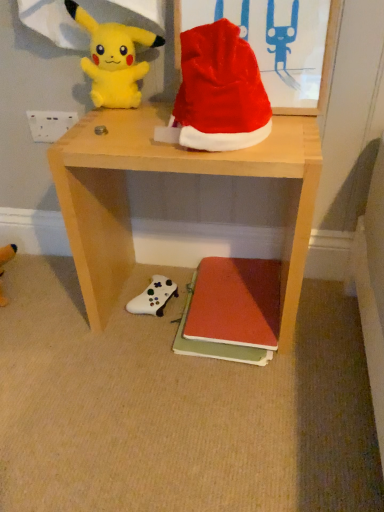
Question: Should I look upward or downward to see white matte game controller at lower center, acting as the first toy starting from the back?

Choices:
 (A) up
 (B) down

Answer: (B)

Question: Is wooden desk at center aimed at white matte game controller at lower center, positioned as the 2th toy in top-to-bottom order?

Choices:
 (A) no
 (B) yes

Answer: (A)

Question: Is wooden desk at center far from white matte game controller at lower center, acting as the second toy starting from the front?

Choices:
 (A) yes
 (B) no

Answer: (B)

Question: Can you confirm if wooden desk at center is positioned to the right of white matte game controller at lower center, which ranks as the first toy in bottom-to-top order?

Choices:
 (A) no
 (B) yes

Answer: (B)

Question: Does wooden desk at center lie in front of white matte game controller at lower center, positioned as the 2th toy in top-to-bottom order?

Choices:
 (A) yes
 (B) no

Answer: (A)

Question: Considering the relative sizes of wooden desk at center and white matte game controller at lower center, acting as the first toy starting from the back, in the image provided, is wooden desk at center shorter than white matte game controller at lower center, acting as the first toy starting from the back,?

Choices:
 (A) yes
 (B) no

Answer: (B)

Question: Is wooden desk at center to the left of white matte game controller at lower center, acting as the first toy starting from the back, from the viewer's perspective?

Choices:
 (A) no
 (B) yes

Answer: (A)

Question: Considering the relative positions of shiny fabric santa hat at upper center and white matte game controller at lower center, which ranks as the first toy in bottom-to-top order, in the image provided, is shiny fabric santa hat at upper center behind white matte game controller at lower center, which ranks as the first toy in bottom-to-top order,?

Choices:
 (A) yes
 (B) no

Answer: (B)

Question: Does shiny fabric santa hat at upper center have a lesser width compared to white matte game controller at lower center, which ranks as the first toy in bottom-to-top order?

Choices:
 (A) no
 (B) yes

Answer: (B)

Question: From a real-world perspective, is shiny fabric santa hat at upper center beneath white matte game controller at lower center, acting as the first toy starting from the back?

Choices:
 (A) yes
 (B) no

Answer: (B)

Question: Is shiny fabric santa hat at upper center positioned before white matte game controller at lower center, which ranks as the first toy in bottom-to-top order?

Choices:
 (A) yes
 (B) no

Answer: (A)

Question: From a real-world perspective, is shiny fabric santa hat at upper center on white matte game controller at lower center, acting as the second toy starting from the front?

Choices:
 (A) no
 (B) yes

Answer: (B)

Question: From the image's perspective, would you say shiny fabric santa hat at upper center is shown under white matte game controller at lower center, acting as the second toy starting from the front?

Choices:
 (A) no
 (B) yes

Answer: (A)

Question: Does shiny fabric santa hat at upper center have a lesser width compared to wooden desk at center?

Choices:
 (A) no
 (B) yes

Answer: (B)